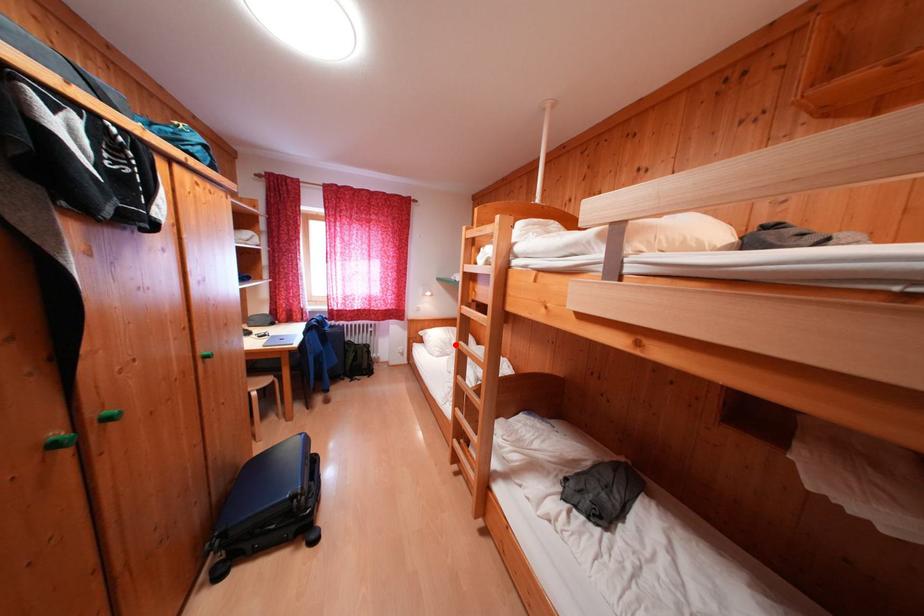
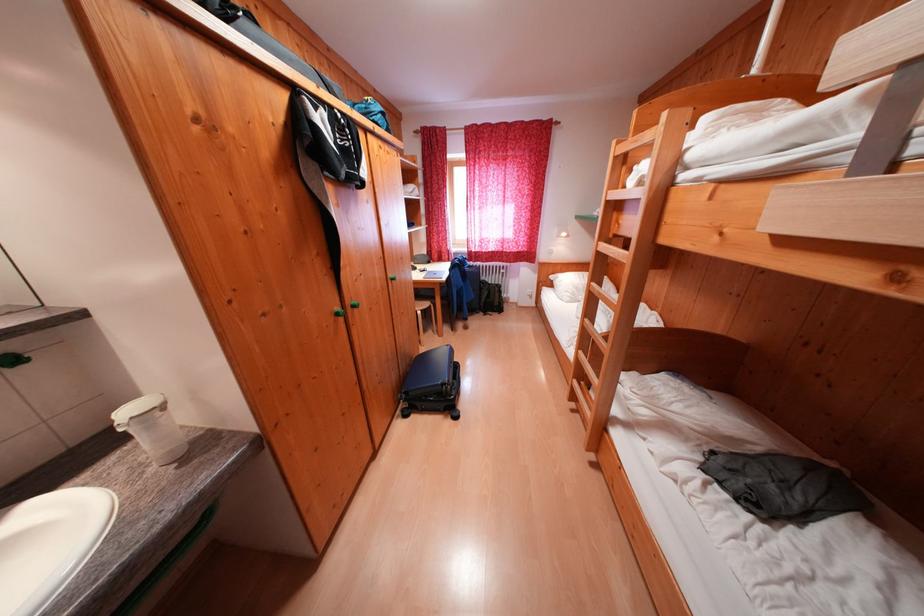
The point at the highlighted location is marked in the first image. Where is the corresponding point in the second image?

(589, 291)